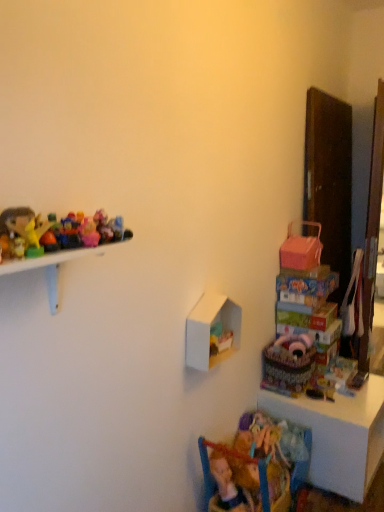
Question: From a real-world perspective, is pink plastic doll at upper left, positioned as the third toy in left-to-right order, physically located above or below translucent plastic toys at upper left, which is counted as the 3th toy, starting from the top?

Choices:
 (A) above
 (B) below

Answer: (B)

Question: From the image's perspective, is pink plastic doll at upper left, acting as the 4th toy starting from the bottom, located above or below translucent plastic toys at upper left, the second toy ordered from the bottom?

Choices:
 (A) below
 (B) above

Answer: (B)

Question: Which of these objects is positioned farthest from the pink plastic doll at upper left, acting as the 4th toy starting from the bottom?

Choices:
 (A) textured fabric basket at lower right
 (B) shiny plastic toys at left, which is counted as the first toy, starting from the front
 (C) white matte shelf at center
 (D) blue fabric chair at lower center
 (E) wooden toy box at lower right

Answer: (E)

Question: Considering the real-world distances, which object is farthest from the textured fabric basket at lower right?

Choices:
 (A) pink plastic doll at upper left, placed as the second toy when sorted from back to front
 (B) blue fabric chair at lower center
 (C) shiny plastic toys at left, the fourth toy in the back-to-front sequence
 (D) pink fabric stuffed animal at lower right, the first toy positioned from the back
 (E) translucent plastic toys at upper left, the second toy ordered from the bottom

Answer: (C)